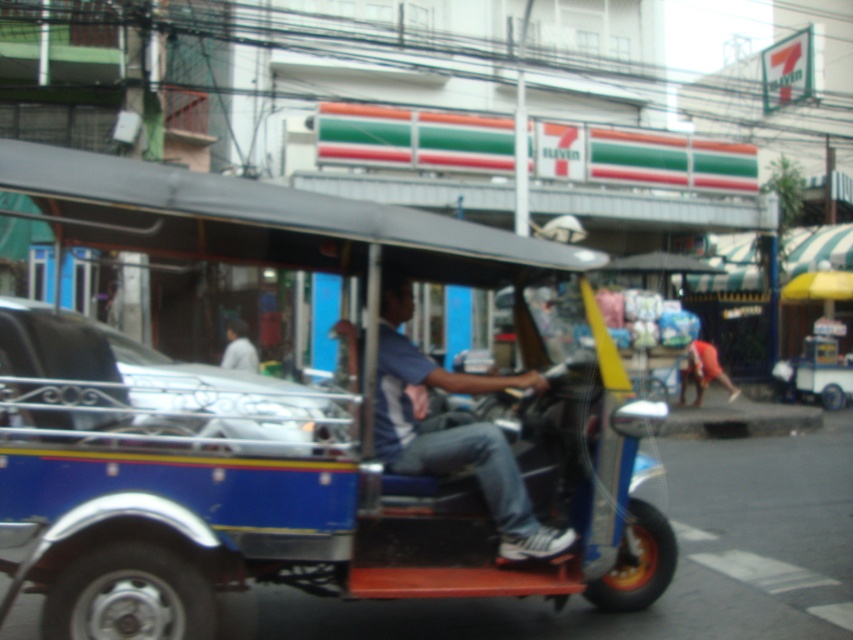
Is blue denim jeans at center above light gray fabric shirt at center?

No, blue denim jeans at center is not above light gray fabric shirt at center.

Image resolution: width=853 pixels, height=640 pixels. Find the location of `blue denim jeans at center`. blue denim jeans at center is located at coordinates (451, 429).

Is blue metallic tricycle at center positioned before red fabric shirt at lower right?

Yes.

Is point (337, 566) in front of point (717, 364)?

Yes, point (337, 566) is in front of point (717, 364).

Locate an element on the screen. blue metallic tricycle at center is located at coordinates (293, 426).

Does red fabric shirt at lower right appear over light gray fabric shirt at center?

Incorrect, red fabric shirt at lower right is not positioned above light gray fabric shirt at center.

Describe the element at coordinates (703, 371) in the screenshot. I see `red fabric shirt at lower right` at that location.

What are the coordinates of `red fabric shirt at lower right` in the screenshot? It's located at (703, 371).